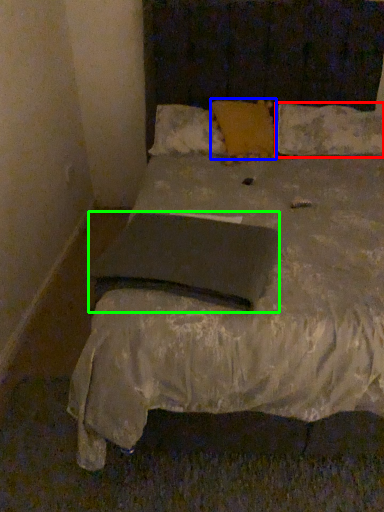
Question: Estimate the real-world distances between objects in this image. Which object is closer to pillow (highlighted by a red box), pillow (highlighted by a blue box) or pad (highlighted by a green box)?

Choices:
 (A) pillow
 (B) pad

Answer: (A)